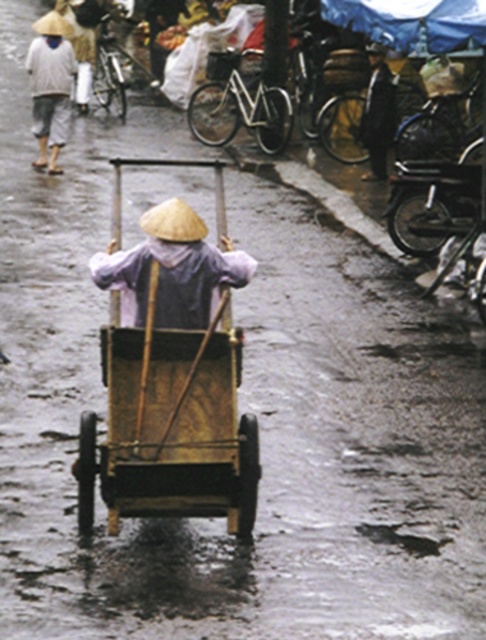
You are a delivery person who needs to pass under a low hanging tree branch that is exactly 1.8 meters high. You are currently pushing the wooden cart at center and wearing the matte straw hat at center. Can you pass under the branch without bending down?

The wooden cart at center is much taller than the matte straw hat at center. Since the cart is taller than the hat, and the branch is 1.8 meters high, if the cart exceeds 1.8 meters in height, you would not be able to pass under the branch without bending down. However, without specific height measurements, it is impossible to definitively answer whether the cart itself is under or over 1.8 meters. The information provided only states the cart is taller than the hat, but not by how much.

You are a customer at the market and want to approach the seller wearing the white cotton shirt at upper left. Which direction should you move from the wooden cart at center to reach them?

The wooden cart at center is to the right of the white cotton shirt at upper left, so you should move to the left from the wooden cart at center to reach the seller wearing the white cotton shirt at upper left.